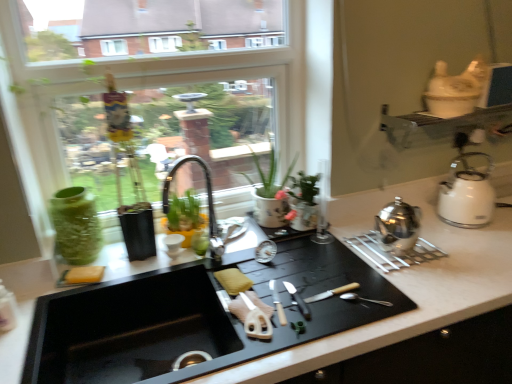
Identify the location of transparent glass window at upper center. This screenshot has width=512, height=384. (262, 76).

This screenshot has width=512, height=384. In order to click on yellow sponge at sink, the first food in the right-to-left sequence in this screenshot , I will do `click(233, 281)`.

What do you see at coordinates (207, 202) in the screenshot? This screenshot has height=384, width=512. I see `matte black faucet at center` at bounding box center [207, 202].

Measure the distance between silver metallic knife at center, which appears as the 1th knife when viewed from the left, and camera.

1.08 meters.

Locate an element on the screen. This screenshot has height=384, width=512. black matte countertop at center is located at coordinates (403, 288).

Identify the location of transparent glass window at upper center. (262, 76).

Considering the relative sizes of green glass vase at left and white glossy kettle at right, the 2th kitchen appliance positioned from the front, in the image provided, is green glass vase at left shorter than white glossy kettle at right, the 2th kitchen appliance positioned from the front,?

No.

Looking at this image, is green glass vase at left directly adjacent to white glossy kettle at right, the 1th kitchen appliance positioned from the right?

green glass vase at left is not next to white glossy kettle at right, the 1th kitchen appliance positioned from the right, and they're not touching.

Could you tell me if green glass vase at left is turned towards white glossy kettle at right, the 1th kitchen appliance positioned from the right?

No, green glass vase at left is not oriented towards white glossy kettle at right, the 1th kitchen appliance positioned from the right.

From the image's perspective, is green glass vase at left above white glossy kettle at right, the first kitchen appliance when ordered from back to front?

No.

Measure the distance from yellow sponge at sink, which is the 2th food in left-to-right order, to green matte pot at center.

yellow sponge at sink, which is the 2th food in left-to-right order, is 2.88 meters from green matte pot at center.

Can you confirm if yellow sponge at sink, the first food in the right-to-left sequence, is wider than green matte pot at center?

In fact, yellow sponge at sink, the first food in the right-to-left sequence, might be narrower than green matte pot at center.

From a real-world perspective, which is physically below, yellow sponge at sink, which is the 2th food in left-to-right order, or green matte pot at center?

yellow sponge at sink, which is the 2th food in left-to-right order, from a real-world perspective.

From the image's perspective, is yellow sponge at sink, which is the 2th food in left-to-right order, on green matte pot at center?

Incorrect, from the image's perspective, yellow sponge at sink, which is the 2th food in left-to-right order, is lower than green matte pot at center.

Which object is positioned more to the left, white glossy kettle at right, which ranks as the 2th kitchen appliance in left-to-right order, or yellow sponge at sink, the 2th food in the right-to-left sequence?

yellow sponge at sink, the 2th food in the right-to-left sequence, is more to the left.

Can you confirm if white glossy kettle at right, the 1th kitchen appliance positioned from the right, is thinner than yellow sponge at sink, the 2th food in the right-to-left sequence?

Incorrect, the width of white glossy kettle at right, the 1th kitchen appliance positioned from the right, is not less than that of yellow sponge at sink, the 2th food in the right-to-left sequence.

Is white glossy kettle at right, the first kitchen appliance when ordered from back to front, aimed at yellow sponge at sink, the 2th food in the right-to-left sequence?

No, white glossy kettle at right, the first kitchen appliance when ordered from back to front, is not turned towards yellow sponge at sink, the 2th food in the right-to-left sequence.

At what (x,y) coordinates should I click in order to perform the action: click on the 2nd knife below the white glossy kettle at right, the first kitchen appliance when ordered from back to front (from the image's perspective). Please return your answer as a coordinate pair (x, y). This screenshot has height=384, width=512. Looking at the image, I should click on (278, 303).

From the image's perspective, between silver metallic knife at center, arranged as the second knife when viewed from the right, and white glossy kettle at right, which ranks as the 2th kitchen appliance in left-to-right order, who is located below?

silver metallic knife at center, arranged as the second knife when viewed from the right, from the image's perspective.

How far apart are silver metallic knife at center, arranged as the second knife when viewed from the right, and white glossy kettle at right, the 2th kitchen appliance positioned from the front?

33.19 inches.

Is silver metallic knife at center, which appears as the 1th knife when viewed from the left, surrounding white glossy kettle at right, the first kitchen appliance when ordered from back to front?

That's incorrect, white glossy kettle at right, the first kitchen appliance when ordered from back to front, is not inside silver metallic knife at center, which appears as the 1th knife when viewed from the left.

Between white glossy kettle at right, the first kitchen appliance when ordered from back to front, and transparent glass window at upper center, which one is positioned behind?

white glossy kettle at right, the first kitchen appliance when ordered from back to front, is behind.

Considering the relative sizes of white glossy kettle at right, the first kitchen appliance when ordered from back to front, and transparent glass window at upper center in the image provided, is white glossy kettle at right, the first kitchen appliance when ordered from back to front, wider than transparent glass window at upper center?

Indeed, white glossy kettle at right, the first kitchen appliance when ordered from back to front, has a greater width compared to transparent glass window at upper center.

Considering the sizes of white glossy kettle at right, the 2th kitchen appliance positioned from the front, and transparent glass window at upper center in the image, is white glossy kettle at right, the 2th kitchen appliance positioned from the front, bigger or smaller than transparent glass window at upper center?

In the image, white glossy kettle at right, the 2th kitchen appliance positioned from the front, appears to be smaller than transparent glass window at upper center.

Can you confirm if white glossy kettle at right, the 1th kitchen appliance positioned from the right, is shorter than transparent glass window at upper center?

Correct, white glossy kettle at right, the 1th kitchen appliance positioned from the right, is not as tall as transparent glass window at upper center.

Would you consider silver metallic knife at center, arranged as the second knife when viewed from the right, to be distant from matte black faucet at center?

Yes, silver metallic knife at center, arranged as the second knife when viewed from the right, and matte black faucet at center are quite far apart.

Consider the image. Considering the sizes of objects silver metallic knife at center, arranged as the second knife when viewed from the right, and matte black faucet at center in the image provided, who is thinner, silver metallic knife at center, arranged as the second knife when viewed from the right, or matte black faucet at center?

matte black faucet at center is thinner.

Is silver metallic knife at center, which appears as the 1th knife when viewed from the left, at the right side of matte black faucet at center?

Yes, silver metallic knife at center, which appears as the 1th knife when viewed from the left, is to the right of matte black faucet at center.

Is silver metallic knife at center, marked as the first knife in a right-to-left arrangement, far from matte black faucet at center?

Indeed, silver metallic knife at center, marked as the first knife in a right-to-left arrangement, is not near matte black faucet at center.

Is matte black faucet at center inside silver metallic knife at center, marked as the first knife in a right-to-left arrangement?

Actually, matte black faucet at center is outside silver metallic knife at center, marked as the first knife in a right-to-left arrangement.

From the image's perspective, is silver metallic knife at center, the second knife from the left, over matte black faucet at center?

No, from the image's perspective, silver metallic knife at center, the second knife from the left, is not over matte black faucet at center.

From a real-world perspective, count 1st kitchen appliances downward from the green glass vase at left and point to it. Please provide its 2D coordinates.

[(467, 194)]

The width and height of the screenshot is (512, 384). I want to click on the 1st food below the green matte pot at center (from the image's perspective), so click(233, 281).

Looking at the image, which one is located further to yellow sponge at sink, placed as the 1th food when sorted from left to right, satin silver teapot at right, which ranks as the first kitchen appliance in left-to-right order, or black matte countertop at center?

satin silver teapot at right, which ranks as the first kitchen appliance in left-to-right order, is further to yellow sponge at sink, placed as the 1th food when sorted from left to right.

When comparing their distances from matte black faucet at center, does silver metallic knife at center, arranged as the second knife when viewed from the right, or silver metallic knife at center, marked as the first knife in a right-to-left arrangement, seem further?

silver metallic knife at center, marked as the first knife in a right-to-left arrangement, is positioned further to the anchor matte black faucet at center.

Based on their spatial positions, is green glass vase at left or transparent glass window at upper center further from silver metallic knife at center, which appears as the 1th knife when viewed from the left?

transparent glass window at upper center is further to silver metallic knife at center, which appears as the 1th knife when viewed from the left.

Based on their spatial positions, is yellow sponge at sink, which is the 2th food in left-to-right order, or silver metallic knife at center, the second knife from the left, further from yellow sponge at sink, placed as the 1th food when sorted from left to right?

Among the two, silver metallic knife at center, the second knife from the left, is located further to yellow sponge at sink, placed as the 1th food when sorted from left to right.

When comparing their distances from satin silver teapot at right, marked as the 2th kitchen appliance in a right-to-left arrangement, does yellow sponge at sink, the first food in the right-to-left sequence, or yellow sponge at sink, placed as the 1th food when sorted from left to right, seem further?

yellow sponge at sink, placed as the 1th food when sorted from left to right, is further to satin silver teapot at right, marked as the 2th kitchen appliance in a right-to-left arrangement.

Considering their positions, is silver metallic knife at center, which appears as the 1th knife when viewed from the left, positioned further to satin silver teapot at right, acting as the 1th kitchen appliance starting from the front, than green glass vase at left?

green glass vase at left is positioned further to the anchor satin silver teapot at right, acting as the 1th kitchen appliance starting from the front.

From the image, which object appears to be farther from black matte countertop at center, white glossy kettle at right, the 1th kitchen appliance positioned from the right, or yellow sponge at sink, the 2th food in the right-to-left sequence?

Among the two, yellow sponge at sink, the 2th food in the right-to-left sequence, is located further to black matte countertop at center.

Looking at the image, which one is located closer to yellow sponge at sink, the first food in the right-to-left sequence, white glossy kettle at right, which ranks as the 2th kitchen appliance in left-to-right order, or green glass vase at left?

The object closer to yellow sponge at sink, the first food in the right-to-left sequence, is green glass vase at left.

Locate an element on the screen. faucet between green matte pot at center and yellow sponge at sink, the first food in the right-to-left sequence, in the up-down direction is located at coordinates (207, 202).

At what (x,y) coordinates should I click in order to perform the action: click on window between green glass vase at left and green matte pot at center from left to right. Please return your answer as a coordinate pair (x, y). Looking at the image, I should click on (262, 76).

The image size is (512, 384). Identify the location of faucet positioned between black matte countertop at center and green matte pot at center from near to far. (207, 202).

What are the coordinates of `kitchen appliance between green matte pot at center and white glossy kettle at right, which ranks as the 2th kitchen appliance in left-to-right order` in the screenshot? It's located at (398, 227).